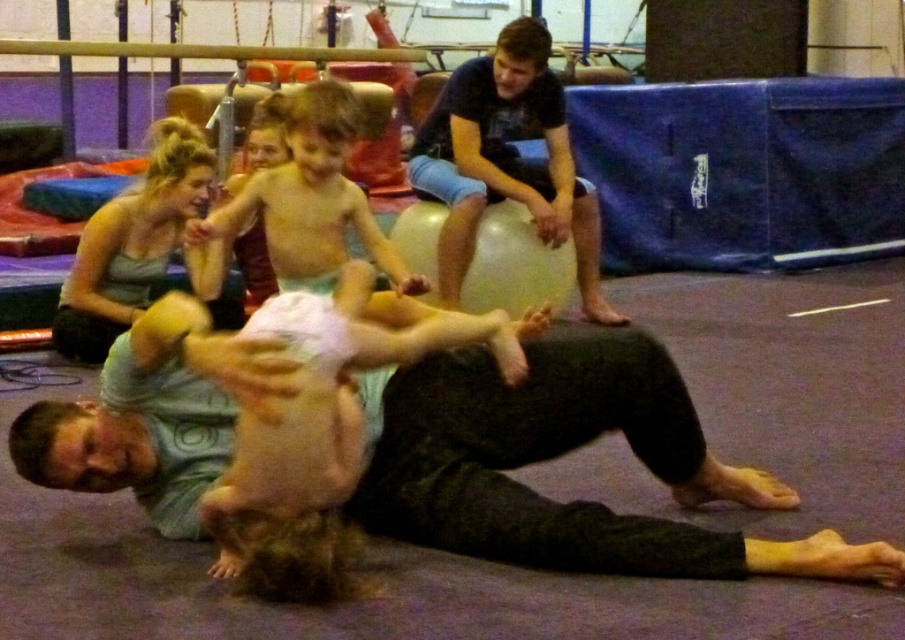
Question: Considering the relative positions of dark blue t-shirt at upper center and smooth skin child at center in the image provided, where is dark blue t-shirt at upper center located with respect to smooth skin child at center?

Choices:
 (A) right
 (B) left

Answer: (A)

Question: Which object is the farthest from the dark blue t-shirt at upper center?

Choices:
 (A) matte green tank top at upper left
 (B) light green t-shirt at center
 (C) smooth skin child at center

Answer: (B)

Question: Which point is closer to the camera?

Choices:
 (A) smooth skin child at center
 (B) matte green tank top at upper left
 (C) dark blue t-shirt at upper center
 (D) light green t-shirt at center

Answer: (D)

Question: In this image, where is light green t-shirt at center located relative to matte green tank top at upper left?

Choices:
 (A) below
 (B) above

Answer: (A)

Question: Which object appears farthest from the camera in this image?

Choices:
 (A) dark blue t-shirt at upper center
 (B) smooth skin child at center

Answer: (A)

Question: Can you confirm if light green t-shirt at center is positioned above smooth skin child at center?

Choices:
 (A) no
 (B) yes

Answer: (A)